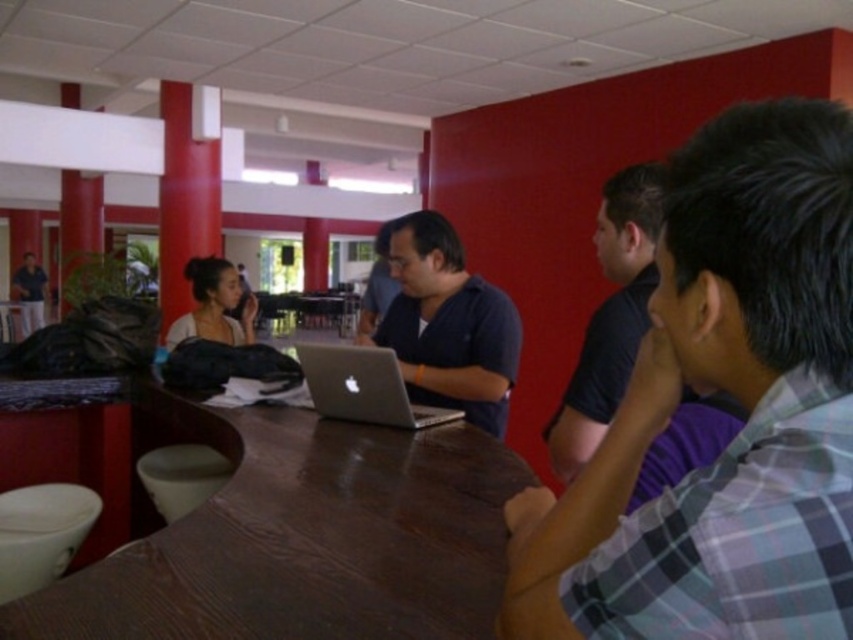
You are standing in the room and want to hand a document to the person wearing the matte black shirt at center. However, there is a matte black laptop at left on the table. Can you reach the person without moving the laptop?

The matte black shirt at center is located below the matte black laptop at left, so the laptop is positioned above the shirt. Therefore, you can reach the person without moving the laptop as it is placed higher up on the table.

You are standing in the lounge area and want to hand a document to the person in the matte black shirt at center. Based on their position relative to others, where should you approach from?

The matte black shirt at center is located at point [376,284], so you should approach from the front to ensure they can see you and receive the document properly.